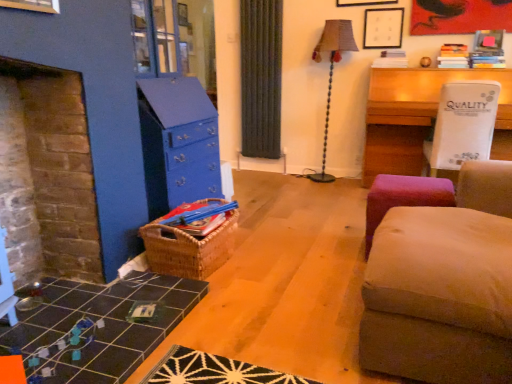
Question: From a real-world perspective, is white plastic table at upper right, which ranks as the 2th table in left-to-right order, on matte black picture frame at upper center?

Choices:
 (A) yes
 (B) no

Answer: (B)

Question: From the image's perspective, is white plastic table at upper right, which ranks as the 2th table in left-to-right order, on matte black picture frame at upper center?

Choices:
 (A) yes
 (B) no

Answer: (B)

Question: Is white plastic table at upper right, which ranks as the 2th table in left-to-right order, not within matte black picture frame at upper center?

Choices:
 (A) no
 (B) yes

Answer: (B)

Question: Considering the relative sizes of white plastic table at upper right, marked as the second table in a bottom-to-top arrangement, and matte black picture frame at upper center in the image provided, is white plastic table at upper right, marked as the second table in a bottom-to-top arrangement, bigger than matte black picture frame at upper center?

Choices:
 (A) yes
 (B) no

Answer: (A)

Question: Is white plastic table at upper right, the 1th table from the back, directly adjacent to matte black picture frame at upper center?

Choices:
 (A) no
 (B) yes

Answer: (A)

Question: Does white plastic table at upper right, which appears as the first table when viewed from the top, contain matte black picture frame at upper center?

Choices:
 (A) no
 (B) yes

Answer: (A)

Question: Is woven brown basket at center a part of pink fabric stool at lower right?

Choices:
 (A) yes
 (B) no

Answer: (B)

Question: Can you confirm if pink fabric stool at lower right is wider than woven brown basket at center?

Choices:
 (A) no
 (B) yes

Answer: (B)

Question: Considering the relative positions of pink fabric stool at lower right and woven brown basket at center in the image provided, is pink fabric stool at lower right to the right of woven brown basket at center from the viewer's perspective?

Choices:
 (A) no
 (B) yes

Answer: (B)

Question: Is pink fabric stool at lower right bigger than woven brown basket at center?

Choices:
 (A) yes
 (B) no

Answer: (A)

Question: Considering the relative positions of pink fabric stool at lower right and woven brown basket at center in the image provided, is pink fabric stool at lower right behind woven brown basket at center?

Choices:
 (A) no
 (B) yes

Answer: (B)

Question: Is pink fabric stool at lower right smaller than woven brown basket at center?

Choices:
 (A) no
 (B) yes

Answer: (A)

Question: Considering the relative positions of velvet beige ottoman at right and black tile table at lower left, the 1th table from the left, in the image provided, is velvet beige ottoman at right behind black tile table at lower left, the 1th table from the left,?

Choices:
 (A) yes
 (B) no

Answer: (B)